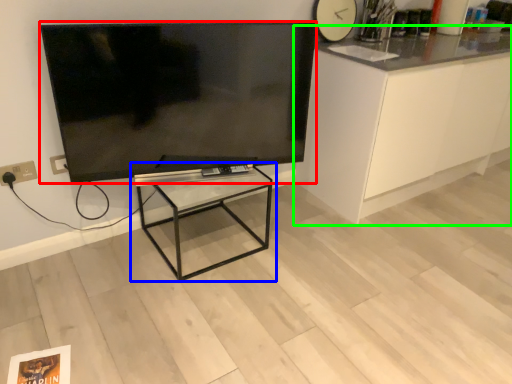
Question: Which object is positioned farthest from television (highlighted by a red box)? Select from table (highlighted by a blue box) and cabinetry (highlighted by a green box).

Choices:
 (A) table
 (B) cabinetry

Answer: (B)